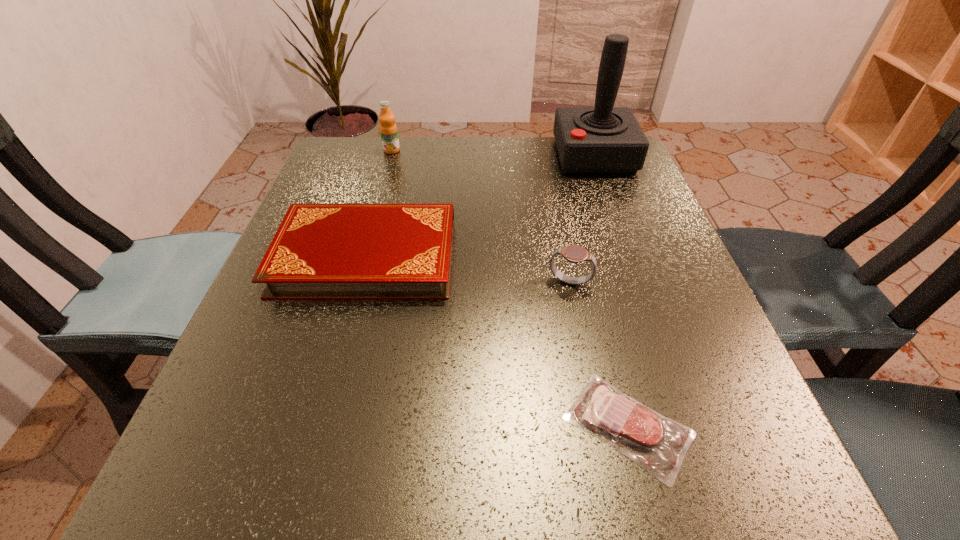
Identify the location of object identified as the second closest to the hardback book. (658, 444).

You are a GUI agent. You are given a task and a screenshot of the screen. Output one action in this format:
    pyautogui.click(x=<x>, y=<y>)
    Task: Click on the free space that satisfies the following two spatial constraints: 1. on the label of the watch; 2. on the left side of the orange juice
    
    Given the screenshot: What is the action you would take?
    pyautogui.click(x=354, y=283)

The height and width of the screenshot is (540, 960). Find the location of `free space that satisfies the following two spatial constraints: 1. on the cover of the hardback book; 2. on the back side of the watch`. free space that satisfies the following two spatial constraints: 1. on the cover of the hardback book; 2. on the back side of the watch is located at coordinates (359, 283).

Find the location of a particular element. vacant space that satisfies the following two spatial constraints: 1. on the cover of the shortest object; 2. on the right side of the hardback book is located at coordinates (321, 426).

This screenshot has height=540, width=960. What are the coordinates of `vacant region that satisfies the following two spatial constraints: 1. on the base of the tallest object; 2. on the front side of the shortest object` in the screenshot? It's located at (691, 426).